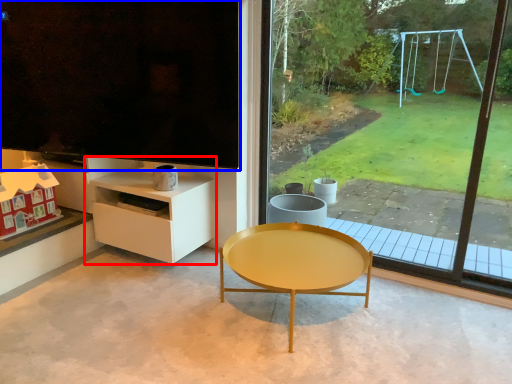
Question: Which point is closer to the camera, shelf (highlighted by a red box) or window screen (highlighted by a blue box)?

Choices:
 (A) shelf
 (B) window screen

Answer: (B)